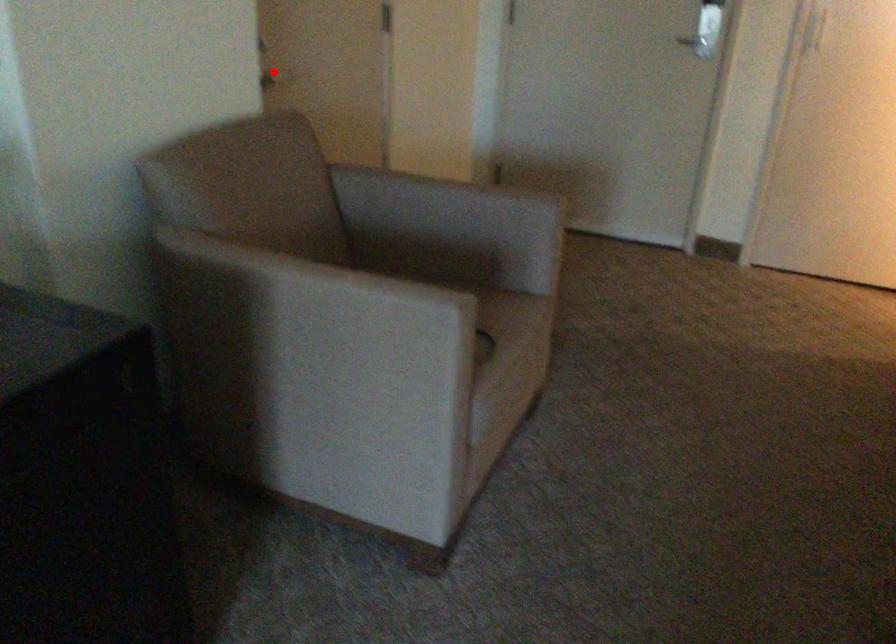
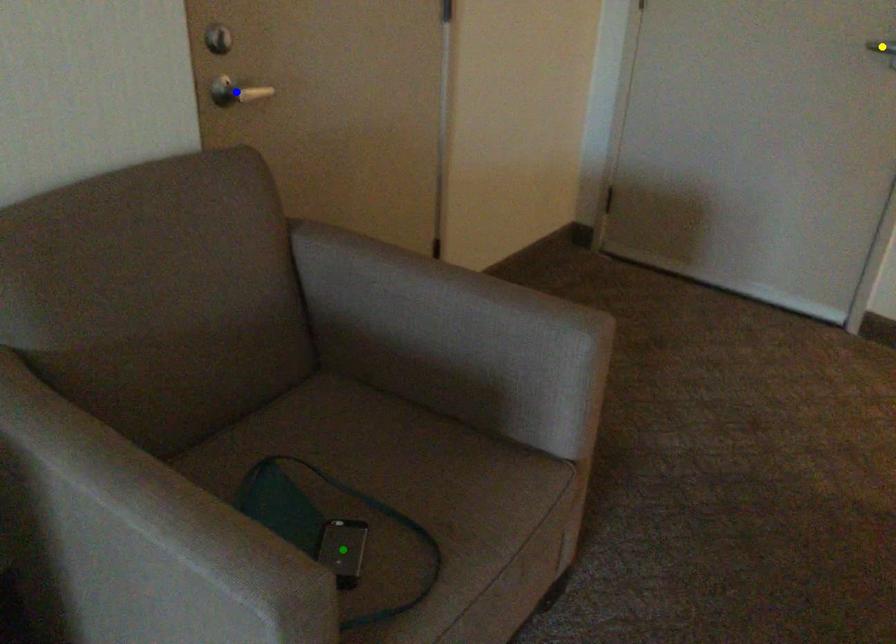
Question: I am providing you with two images of the same scene from different viewpoints. A red point is marked on the first image. You are given multiple points on the second image. Which point in image 2 is actually the same real-world point as the red point in image 1?

Choices:
 (A) blue point
 (B) green point
 (C) yellow point

Answer: (A)